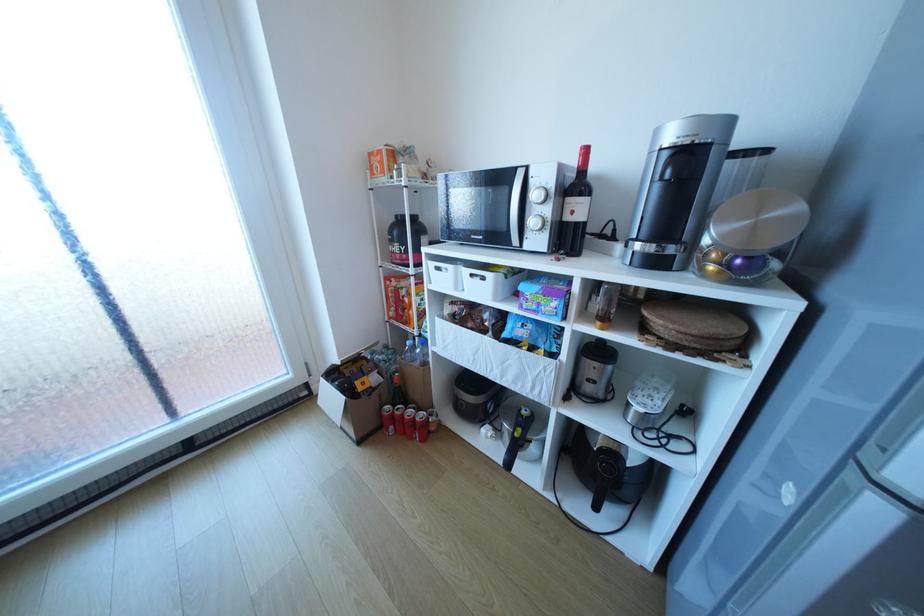
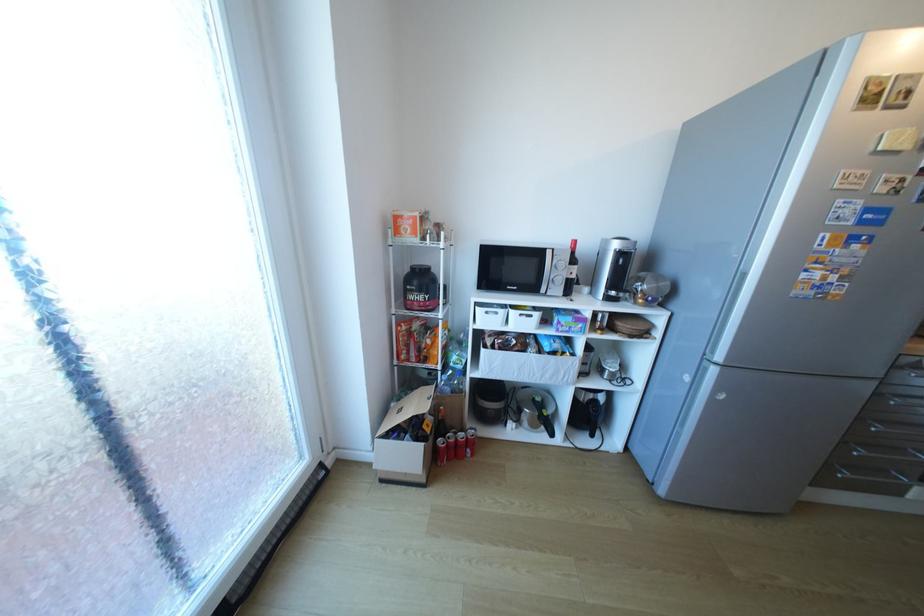
Find the pixel in the second image that matches [423,517] in the first image.

(523, 504)